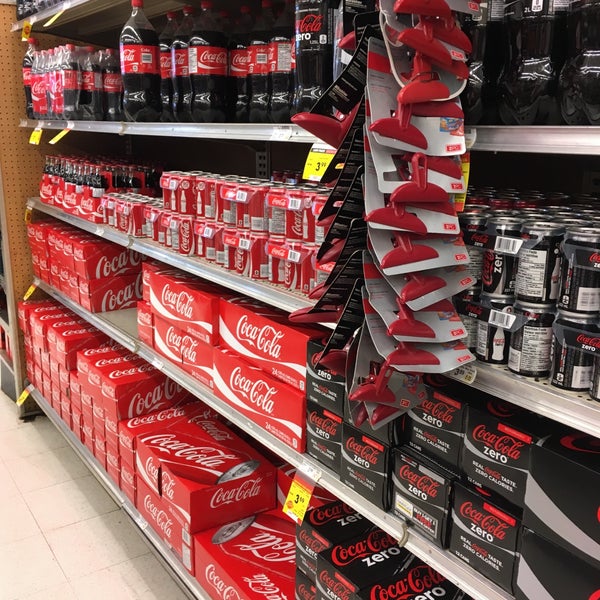
Find the location of `shelf`. shelf is located at coordinates (183, 578), (249, 425), (280, 302), (243, 133), (86, 0).